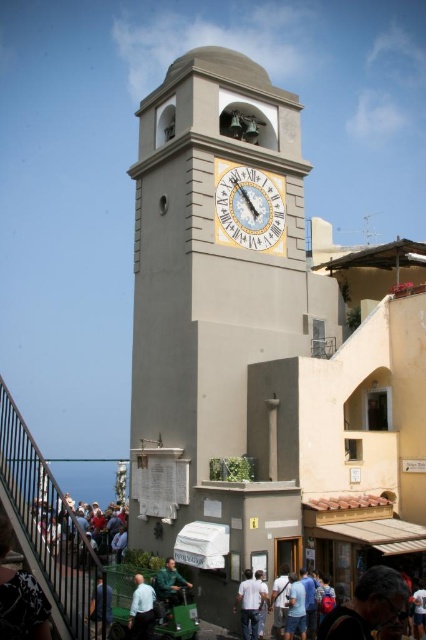
You are standing at the base of the clock tower and want to take a photo of the clock face. The camera you are using has a focal length of 50mm. Given that the point corresponding to the clock face is located at coordinates point (63, 632) and the distance between the camera and this point is 25.69 meters, will the clock face fill the frame of your camera?

The distance between the camera and point (63, 632) is 25.69 meters. To determine if the clock face fills the frame, we need to consider the camera sensor size and field of view. However, without knowing the sensor size or the desired framing, it is impossible to definitively answer. The given information only provides the distance, not the angular size or sensor dimensions required for calculation.

You are a fashion designer observing the Mediterranean clock tower scene. You notice two jackets in the image. Which jacket is taller, the dark brown leather jacket at lower right or the green fabric jacket at center?

The dark brown leather jacket at lower right is taller than the green fabric jacket at center.